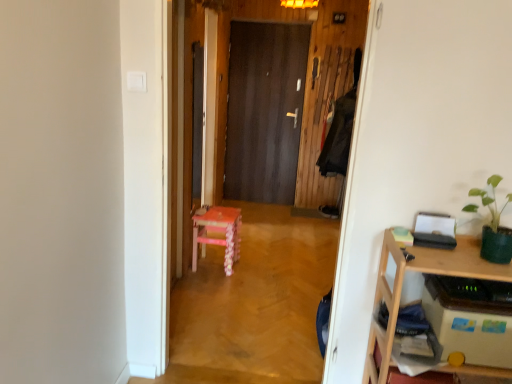
Question: From the image's perspective, is pink wood stool at center above green matte plant at upper right?

Choices:
 (A) yes
 (B) no

Answer: (B)

Question: Can you confirm if pink wood stool at center is wider than green matte plant at upper right?

Choices:
 (A) no
 (B) yes

Answer: (B)

Question: Does pink wood stool at center touch green matte plant at upper right?

Choices:
 (A) yes
 (B) no

Answer: (B)

Question: Does pink wood stool at center appear on the left side of green matte plant at upper right?

Choices:
 (A) no
 (B) yes

Answer: (B)

Question: From the image's perspective, is pink wood stool at center located beneath green matte plant at upper right?

Choices:
 (A) no
 (B) yes

Answer: (B)

Question: From the image's perspective, is wooden desk at right above or below pink wood chair at center?

Choices:
 (A) above
 (B) below

Answer: (B)

Question: In the image, is wooden desk at right on the left side or the right side of pink wood chair at center?

Choices:
 (A) right
 (B) left

Answer: (A)

Question: Would you say wooden desk at right is inside or outside pink wood chair at center?

Choices:
 (A) outside
 (B) inside

Answer: (A)

Question: Relative to pink wood chair at center, is wooden desk at right in front or behind?

Choices:
 (A) front
 (B) behind

Answer: (A)

Question: Which is correct: green matte plant at upper right is inside dark wood door at center, or outside of it?

Choices:
 (A) inside
 (B) outside

Answer: (B)

Question: In terms of width, does green matte plant at upper right look wider or thinner when compared to dark wood door at center?

Choices:
 (A) wide
 (B) thin

Answer: (A)

Question: From the image's perspective, is green matte plant at upper right located above or below dark wood door at center?

Choices:
 (A) below
 (B) above

Answer: (A)

Question: Is green matte plant at upper right in front of or behind dark wood door at center in the image?

Choices:
 (A) front
 (B) behind

Answer: (A)

Question: From a real-world perspective, is pink wood chair at center above or below dark wood door at center?

Choices:
 (A) above
 (B) below

Answer: (B)

Question: Based on their sizes in the image, would you say pink wood chair at center is bigger or smaller than dark wood door at center?

Choices:
 (A) small
 (B) big

Answer: (B)